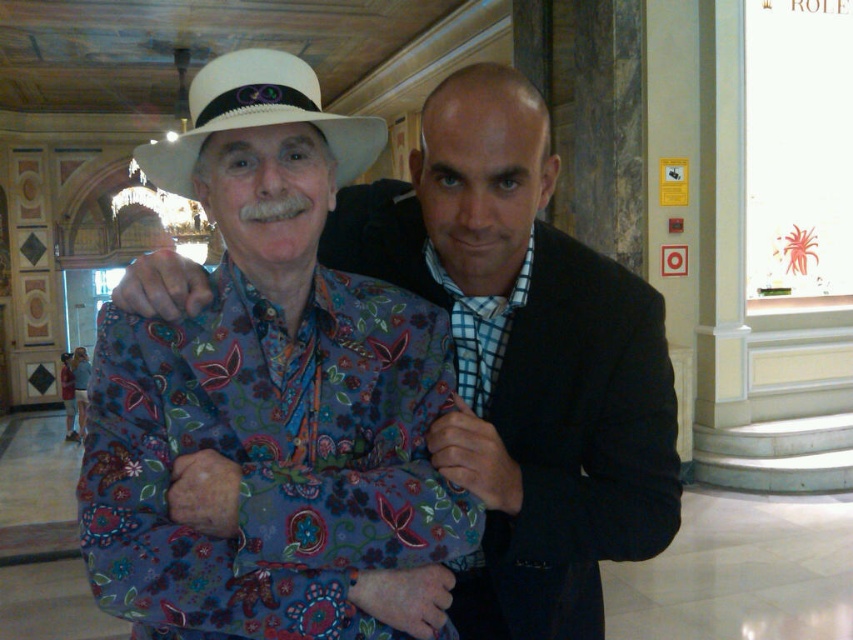
Question: Observing the image, what is the correct spatial positioning of floral fabric shirt at center in reference to white straw fedora at center?

Choices:
 (A) left
 (B) right

Answer: (B)

Question: Can you confirm if floral fabric shirt at center is positioned to the right of white straw fedora at center?

Choices:
 (A) yes
 (B) no

Answer: (A)

Question: Which of the following is the closest to the observer?

Choices:
 (A) white straw fedora at center
 (B) floral fabric shirt at center

Answer: (A)

Question: Which point appears farthest from the camera in this image?

Choices:
 (A) pyautogui.click(x=535, y=374)
 (B) pyautogui.click(x=146, y=161)

Answer: (A)

Question: Can you confirm if floral fabric shirt at center is positioned above white straw fedora at center?

Choices:
 (A) no
 (B) yes

Answer: (A)